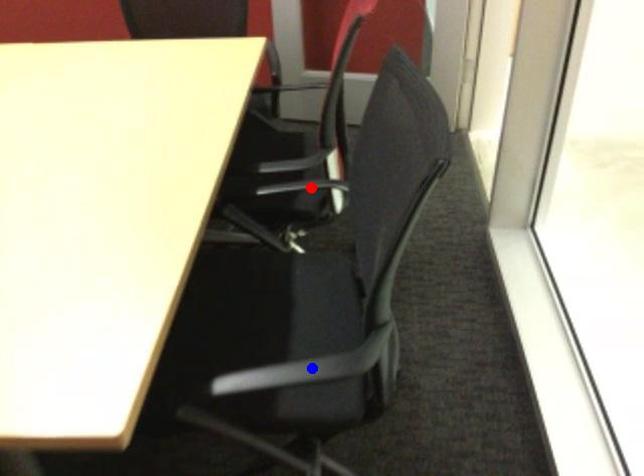
Question: In the image, two points are highlighted. Which point is nearer to the camera? Reply with the corresponding letter.

Choices:
 (A) blue point
 (B) red point

Answer: (A)